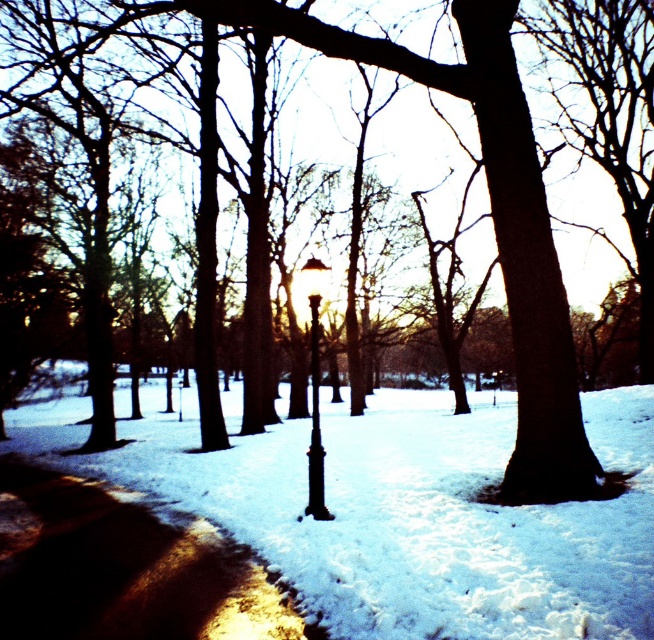
You are a photographer setting up a tripod in the winter scene. You need to place your equipment on the shiny asphalt pavement at lower left and the black metal pole at center. Which surface will allow you to set up more equipment due to its size?

The black metal pole at center occupies more space than the shiny asphalt pavement at lower left, so you can set up more equipment there.

From the picture: You are a delivery person trying to reach the black metal pole at center. You are currently standing on the shiny asphalt pavement at lower left. Can you directly walk towards the pole without moving around any obstacles?

The shiny asphalt pavement at lower left is in front of the black metal pole at center, so you can directly walk towards the pole without needing to move around any obstacles.